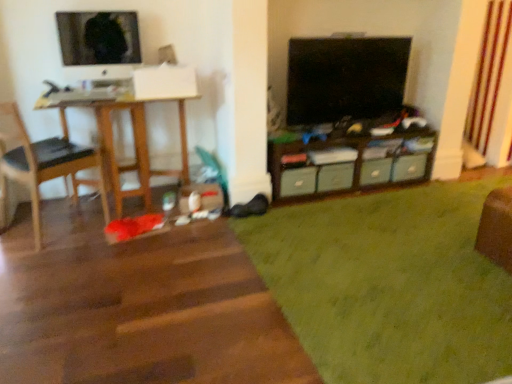
Question: Considering the relative positions of green matte drawer at center, which is the first drawer in left-to-right order, and black leather chair at left in the image provided, is green matte drawer at center, which is the first drawer in left-to-right order, to the left or to the right of black leather chair at left?

Choices:
 (A) left
 (B) right

Answer: (B)

Question: From the image's perspective, is green matte drawer at center, which is the 4th drawer in right-to-left order, positioned above or below black leather chair at left?

Choices:
 (A) above
 (B) below

Answer: (B)

Question: Estimate the real-world distances between objects in this image. Which object is closer to the matte plastic drawer at center, marked as the 4th drawer in a left-to-right arrangement?

Choices:
 (A) wooden cabinet at center
 (B) wooden desk at left
 (C) black leather chair at left
 (D) green matte drawer at center, placed as the 3th drawer when sorted from left to right
 (E) black glossy tv at upper center, which is counted as the first television, starting from the right

Answer: (D)

Question: Considering the real-world distances, which object is farthest from the green shag rug at lower right?

Choices:
 (A) matte plastic drawer at center, which is the 1th drawer in right-to-left order
 (B) green fabric drawer at center, the second drawer when ordered from left to right
 (C) green matte drawer at center, which is the first drawer in left-to-right order
 (D) matte black monitor at upper left, which is the 2th television from right to left
 (E) green matte drawer at center, placed as the 3th drawer when sorted from left to right

Answer: (D)